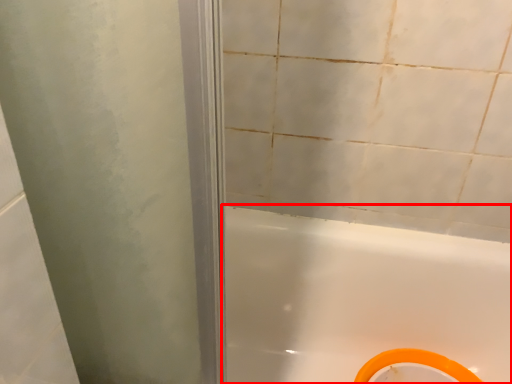
Question: Observing the image, what is the correct spatial positioning of bathtub (annotated by the red box) in reference to bidet?

Choices:
 (A) left
 (B) right

Answer: (A)